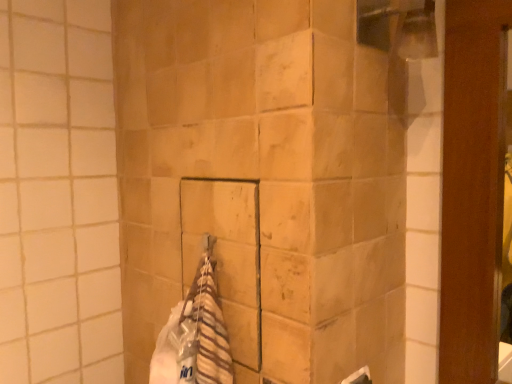
The width and height of the screenshot is (512, 384). Find the location of `white striped towel at center`. white striped towel at center is located at coordinates (194, 337).

This screenshot has height=384, width=512. What do you see at coordinates (194, 337) in the screenshot? I see `white striped towel at center` at bounding box center [194, 337].

At what (x,y) coordinates should I click in order to perform the action: click on white striped towel at center. Please return your answer as a coordinate pair (x, y). The width and height of the screenshot is (512, 384). Looking at the image, I should click on (194, 337).